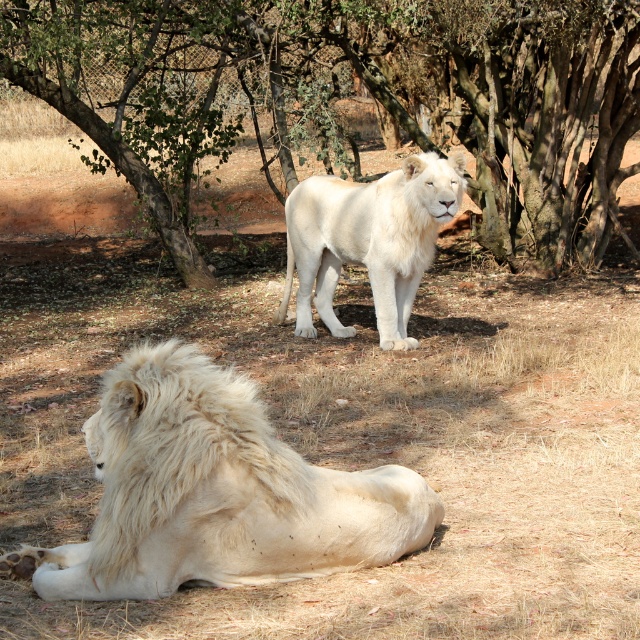
You are standing at the camera position and want to know how far the point at coordinates (296, 177) is from you. Can you determine the distance?

The point at coordinates (296, 177) is 40.08 feet away from the camera position.

You are a visitor at the wildlife park and want to take a photo of both the green leafy tree at upper center and the fuzzy white lion at lower left. Which one should you focus on first to ensure both are in focus?

You should focus on the green leafy tree at upper center first because it is closer to you than the fuzzy white lion at lower left, so adjusting focus from near to far will help both be in focus.

You are a wildlife photographer trying to capture a photo of both lions in the enclosure. Given that the fuzzy white lion at lower left is smaller in size compared to the white fluffy lion at center, which lion would you need to adjust your camera focus on first if you want to ensure both are in focus?

The fuzzy white lion at lower left occupies less space than the white fluffy lion at center, so you should focus on the larger white fluffy lion at center first to ensure proper focus on both.